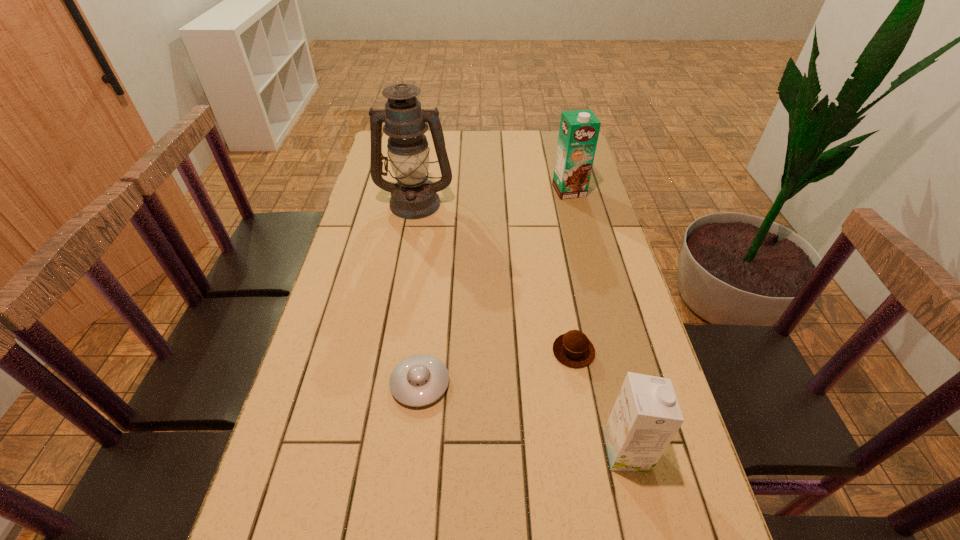
The width and height of the screenshot is (960, 540). I want to click on the tallest object, so click(413, 196).

The image size is (960, 540). I want to click on the farther carton, so click(578, 134).

The image size is (960, 540). What are the coordinates of `the taller carton` in the screenshot? It's located at (578, 134).

Where is `the shorter carton`? The width and height of the screenshot is (960, 540). the shorter carton is located at coordinates (646, 416).

Identify the location of the nearest object. The height and width of the screenshot is (540, 960). (646, 416).

You are a GUI agent. You are given a task and a screenshot of the screen. Output one action in this format:
    pyautogui.click(x=<x>, y=<y>)
    Task: Click on the muffin
    
    Given the screenshot: What is the action you would take?
    pyautogui.click(x=573, y=349)

This screenshot has width=960, height=540. I want to click on the shortest object, so click(x=418, y=380).

You are a GUI agent. You are given a task and a screenshot of the screen. Output one action in this format:
    pyautogui.click(x=<x>, y=<y>)
    Task: Click on the free point located 0.370m on the right of the oil lamp
    
    Given the screenshot: What is the action you would take?
    pyautogui.click(x=562, y=202)

Where is `free location located on the left of the second tallest object`? This screenshot has width=960, height=540. free location located on the left of the second tallest object is located at coordinates coord(537,191).

The height and width of the screenshot is (540, 960). Find the location of `vacant space located on the left of the nearest object`. vacant space located on the left of the nearest object is located at coordinates (498, 451).